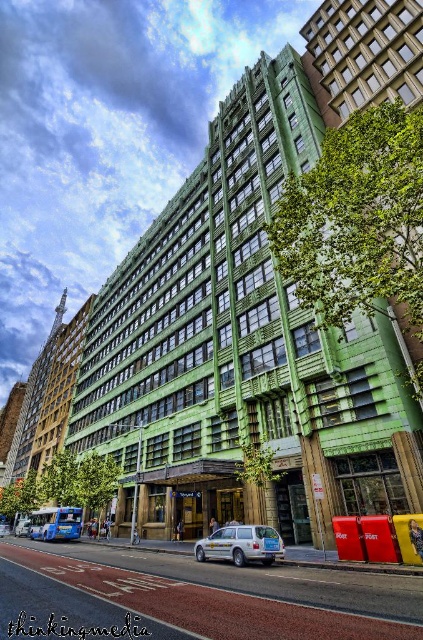
Question: Does white plastic car at center have a larger size compared to matte silver station wagon at center?

Choices:
 (A) no
 (B) yes

Answer: (B)

Question: Which point is farther to the camera?

Choices:
 (A) (233, 636)
 (B) (208, 540)

Answer: (B)

Question: From the image, what is the correct spatial relationship of white plastic car at center in relation to matte silver station wagon at center?

Choices:
 (A) right
 (B) left

Answer: (B)

Question: Where is white plastic car at center located in relation to matte silver station wagon at center in the image?

Choices:
 (A) above
 (B) below

Answer: (B)

Question: Which object appears closest to the camera in this image?

Choices:
 (A) white plastic car at center
 (B) matte silver station wagon at center

Answer: (A)

Question: Among these points, which one is nearest to the camera?

Choices:
 (A) (266, 531)
 (B) (272, 577)

Answer: (B)